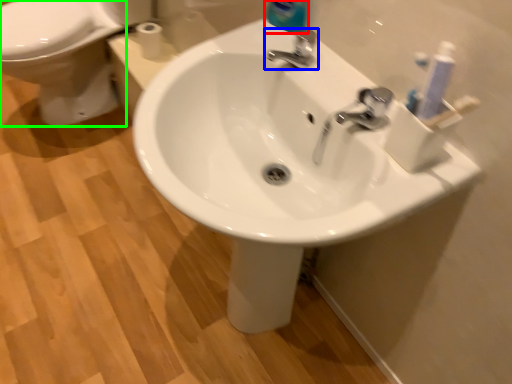
Question: Which object is positioned farthest from cleaning product (highlighted by a red box)? Select from tap (highlighted by a blue box) and bidet (highlighted by a green box).

Choices:
 (A) tap
 (B) bidet

Answer: (B)